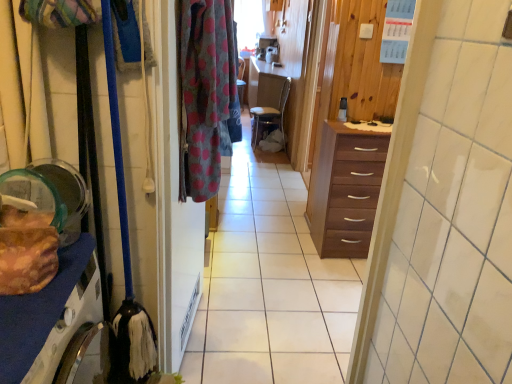
The image size is (512, 384). Describe the element at coordinates (346, 190) in the screenshot. I see `dark brown wood drawer at center, positioned as the first cabinetry in back-to-front order` at that location.

The height and width of the screenshot is (384, 512). Describe the element at coordinates (174, 207) in the screenshot. I see `polka dot fabric screen door at center` at that location.

What is the approximate width of brown woven chair at center?

It is 16.04 inches.

Identify the location of white glossy counter top at center. Image resolution: width=512 pixels, height=384 pixels. (364, 126).

The width and height of the screenshot is (512, 384). In order to click on brown matte cabinet at left, the 2th cabinetry from the back in this screenshot , I will do `click(37, 313)`.

Locate an element on the screen. wooden cabinet at center is located at coordinates (270, 285).

Find the location of a particular element. dark brown wood drawer at center, arranged as the 2th cabinetry when viewed from the front is located at coordinates (346, 190).

Based on their sizes in the image, would you say wooden cabinet at center is bigger or smaller than dark brown wood drawer at center, arranged as the 2th cabinetry when viewed from the front?

wooden cabinet at center is bigger than dark brown wood drawer at center, arranged as the 2th cabinetry when viewed from the front.

Does wooden cabinet at center contain dark brown wood drawer at center, arranged as the 2th cabinetry when viewed from the front?

Actually, dark brown wood drawer at center, arranged as the 2th cabinetry when viewed from the front, is outside wooden cabinet at center.

Which point is more distant from viewer, [332,335] or [354,171]?

Point [354,171]

Is wooden cabinet at center aimed at dark brown wood drawer at center, arranged as the 1th cabinetry when viewed from the right?

No, wooden cabinet at center does not turn towards dark brown wood drawer at center, arranged as the 1th cabinetry when viewed from the right.

Looking at their sizes, would you say brown matte cabinet at left, the 2th cabinetry from the back, is wider or thinner than matte fabric handbag at center?

Clearly, brown matte cabinet at left, the 2th cabinetry from the back, has less width compared to matte fabric handbag at center.

Is brown matte cabinet at left, positioned as the 2th cabinetry in right-to-left order, further to camera compared to matte fabric handbag at center?

No, brown matte cabinet at left, positioned as the 2th cabinetry in right-to-left order, is closer to the camera.

In the scene shown: From the image's perspective, is brown matte cabinet at left, positioned as the 2th cabinetry in right-to-left order, on matte fabric handbag at center?

No, from the image's perspective, brown matte cabinet at left, positioned as the 2th cabinetry in right-to-left order, is not over matte fabric handbag at center.

From a real-world perspective, between brown matte cabinet at left, positioned as the 2th cabinetry in right-to-left order, and matte fabric handbag at center, who is vertically lower?

From a 3D spatial view, matte fabric handbag at center is below.

In the scene shown: Who is shorter, wooden cabinet at center or matte black coffee cup at center?

With less height is wooden cabinet at center.

Can you see wooden cabinet at center touching matte black coffee cup at center?

No, wooden cabinet at center is not making contact with matte black coffee cup at center.

Does wooden cabinet at center have a larger size compared to matte black coffee cup at center?

Indeed, wooden cabinet at center has a larger size compared to matte black coffee cup at center.

Is wooden cabinet at center turned away from matte black coffee cup at center?

No, wooden cabinet at center's orientation is not away from matte black coffee cup at center.

How many degrees apart are the facing directions of wooden cabinet at center and brown matte cabinet at left, which is the first cabinetry in front-to-back order?

The angular difference between wooden cabinet at center and brown matte cabinet at left, which is the first cabinetry in front-to-back order, is 91.4 degrees.

From a real-world perspective, is wooden cabinet at center above or below brown matte cabinet at left, positioned as the 2th cabinetry in right-to-left order?

wooden cabinet at center is situated lower than brown matte cabinet at left, positioned as the 2th cabinetry in right-to-left order, in the real world.

Is wooden cabinet at center not within brown matte cabinet at left, which is the first cabinetry in front-to-back order?

That's correct, wooden cabinet at center is outside of brown matte cabinet at left, which is the first cabinetry in front-to-back order.

Locate an element on the screen. cabinetry that is the 2nd object located below the wooden cabinet at center (from the image's perspective) is located at coordinates (37, 313).

Would you consider matte fabric handbag at center to be distant from wooden cabinet at center?

Yes, matte fabric handbag at center is far from wooden cabinet at center.

From the image's perspective, is matte fabric handbag at center over wooden cabinet at center?

Yes, from the image's perspective, matte fabric handbag at center is over wooden cabinet at center.

In the scene shown: From a real-world perspective, which object rests below the other?

wooden cabinet at center.

From the image's perspective, relative to wooden cabinet at center, is matte black coffee cup at center above or below?

matte black coffee cup at center is above wooden cabinet at center.

Is matte black coffee cup at center directly adjacent to wooden cabinet at center?

matte black coffee cup at center and wooden cabinet at center are clearly separated.

In the image, is matte black coffee cup at center positioned in front of or behind wooden cabinet at center?

In the image, matte black coffee cup at center appears behind wooden cabinet at center.

How many degrees apart are the facing directions of matte black coffee cup at center and wooden cabinet at center?

There is a 3.88-degree angle between the facing directions of matte black coffee cup at center and wooden cabinet at center.

Is dark brown wood drawer at center, which is the second cabinetry in left-to-right order, positioned with its back to polka dot fabric screen door at center?

No, dark brown wood drawer at center, which is the second cabinetry in left-to-right order, is not facing away from polka dot fabric screen door at center.

Is dark brown wood drawer at center, which is the second cabinetry in left-to-right order, completely or partially outside of polka dot fabric screen door at center?

Yes, dark brown wood drawer at center, which is the second cabinetry in left-to-right order, is outside of polka dot fabric screen door at center.

From a real-world perspective, which object rests below the other?

From a 3D spatial view, dark brown wood drawer at center, which is the second cabinetry in left-to-right order, is below.

From the image's perspective, is dark brown wood drawer at center, which is the second cabinetry in left-to-right order, above polka dot fabric screen door at center?

Yes.

The height and width of the screenshot is (384, 512). What are the coordinates of `cabinetry that is on the right side of wooden cabinet at center` in the screenshot? It's located at (346, 190).

Where is `the 2nd cabinetry below the matte fabric handbag at center (from the image's perspective)`? The image size is (512, 384). the 2nd cabinetry below the matte fabric handbag at center (from the image's perspective) is located at coordinates (37, 313).

Which object lies nearer to the anchor point dark brown wood drawer at center, arranged as the 2th cabinetry when viewed from the front, wooden cabinet at center or matte black coffee cup at center?

matte black coffee cup at center.

Looking at the image, which one is located closer to matte fabric handbag at center, dark brown wood drawer at center, positioned as the first cabinetry in back-to-front order, or white glossy counter top at center?

white glossy counter top at center.

Estimate the real-world distances between objects in this image. Which object is closer to matte fabric handbag at center, matte black coffee cup at center or polka dot fabric at center?

matte black coffee cup at center is closer to matte fabric handbag at center.

Based on their spatial positions, is white glossy counter top at center or polka dot fabric at center further from polka dot fabric screen door at center?

Based on the image, white glossy counter top at center appears to be further to polka dot fabric screen door at center.

Looking at the image, which one is located closer to matte black coffee cup at center, white glossy counter top at center or wooden cabinet at center?

white glossy counter top at center lies closer to matte black coffee cup at center than the other object.

Looking at the image, which one is located closer to matte fabric handbag at center, brown matte cabinet at left, the first cabinetry in the left-to-right sequence, or brown woven chair at center?

Among the two, brown woven chair at center is located nearer to matte fabric handbag at center.

Looking at the image, which one is located closer to wooden cabinet at center, brown matte cabinet at left, which is the first cabinetry in front-to-back order, or matte black coffee cup at center?

The object closer to wooden cabinet at center is matte black coffee cup at center.

Looking at the image, which one is located further to wooden cabinet at center, polka dot fabric screen door at center or matte black coffee cup at center?

The object further to wooden cabinet at center is matte black coffee cup at center.

You are a GUI agent. You are given a task and a screenshot of the screen. Output one action in this format:
    pyautogui.click(x=<x>, y=<y>)
    Task: Click on the cabinetry between brown matte cabinet at left, the first cabinetry in the left-to-right sequence, and matte black coffee cup at center, along the z-axis
    
    Given the screenshot: What is the action you would take?
    coord(346,190)

This screenshot has width=512, height=384. In order to click on stuff between brown matte cabinet at left, the 2th cabinetry from the back, and polka dot fabric screen door at center in the front-back direction in this screenshot , I will do `click(26, 251)`.

The height and width of the screenshot is (384, 512). In order to click on stuff positioned between brown matte cabinet at left, the first cabinetry in the left-to-right sequence, and matte black coffee cup at center from near to far in this screenshot , I will do `click(26, 251)`.

Image resolution: width=512 pixels, height=384 pixels. Identify the location of counter top between wooden cabinet at center and brown woven chair at center from front to back. (364, 126).